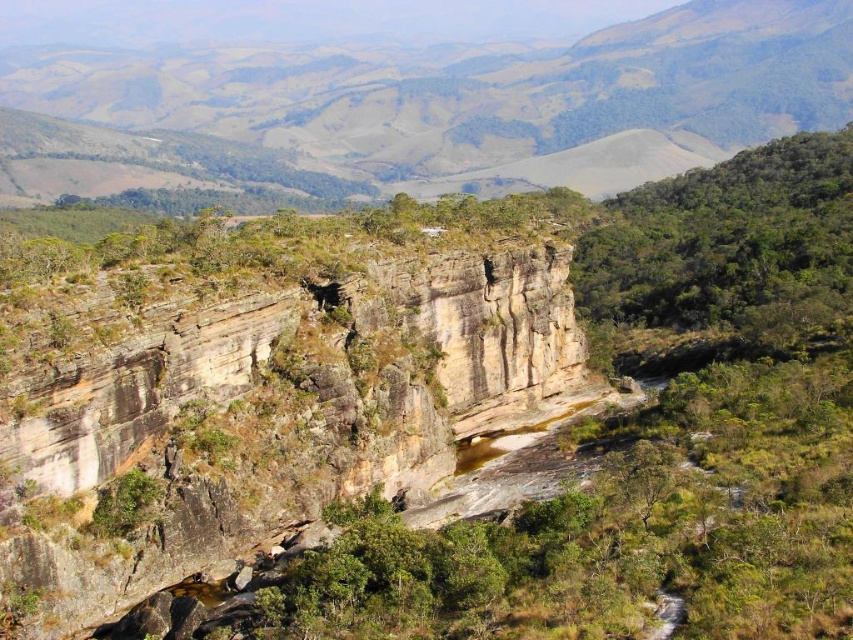
Question: Can you confirm if brown rough rock face at center is positioned to the right of brown rocky cliff at upper center?

Choices:
 (A) no
 (B) yes

Answer: (A)

Question: Which point is farther to the camera?

Choices:
 (A) brown rocky cliff at upper center
 (B) brown rough rock face at center

Answer: (A)

Question: Is brown rough rock face at center positioned at the back of brown rocky cliff at upper center?

Choices:
 (A) yes
 (B) no

Answer: (B)

Question: Which point is farther to the camera?

Choices:
 (A) brown rough rock face at center
 (B) brown rocky cliff at upper center

Answer: (B)

Question: Is brown rough rock face at center above brown rocky cliff at upper center?

Choices:
 (A) no
 (B) yes

Answer: (A)